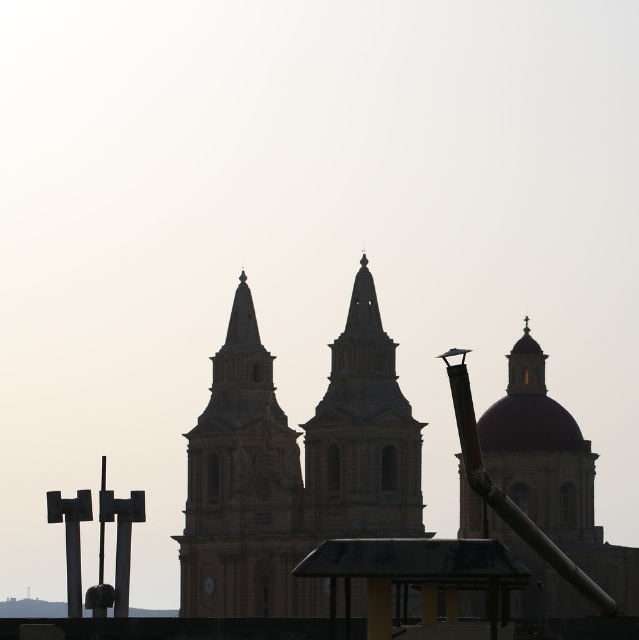
You are standing at the point labeled point [226,588] and want to walk to the base of the central dome of the historic structure. Given that the distance between you and the dome is 151.00 meters, can you estimate how long it would take to walk there at a normal walking speed of 1.4 meters per second?

The distance between point [226,588] and the base of the central dome is 151.00 meters. At a normal walking speed of 1.4 meters per second, it would take approximately 107.86 seconds, which is roughly 1 minute and 48 seconds, to reach the base of the central dome.

Based on the scene description, which object occupies more horizontal space in the image? The beige stone church at center or the beige stone tower at center?

The beige stone church at center is wider than the beige stone tower at center, so it occupies more horizontal space.

You are a drone operator tasked with capturing aerial footage of the beige stone church at center and the beige stone tower at center. The drone has a maximum flight radius of 1 meter from your current position. Can the drone reach both structures without exceeding its range?

The beige stone church at center is 1.24 meters from the beige stone tower at center. Since the drone can only fly up to 1 meter from its current position, it cannot reach both structures within the same flight radius without exceeding its range.